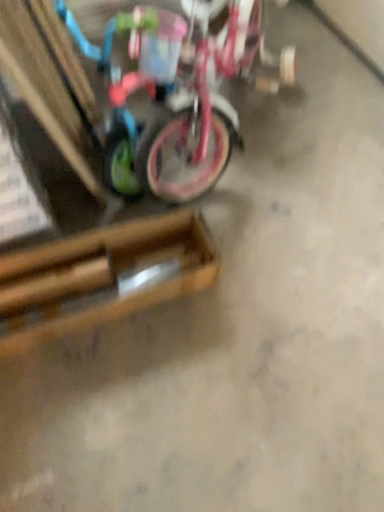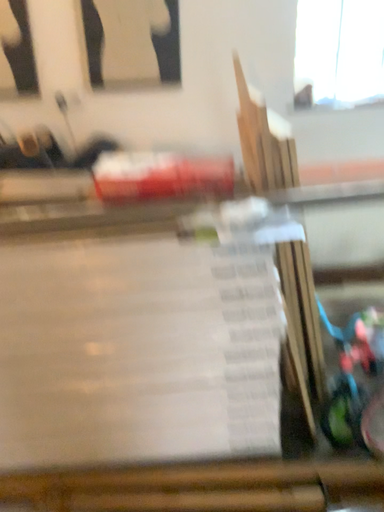
Question: Which way did the camera rotate in the video?

Choices:
 (A) rotated left
 (B) rotated right

Answer: (A)